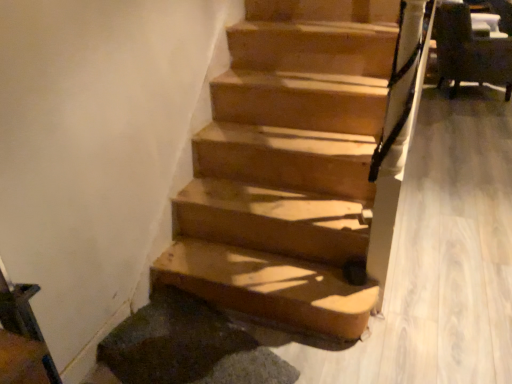
Question: Is dark brown leather armchair at upper right taller than wooden stairs at center?

Choices:
 (A) no
 (B) yes

Answer: (B)

Question: Is dark brown leather armchair at upper right closer to camera compared to wooden stairs at center?

Choices:
 (A) no
 (B) yes

Answer: (A)

Question: Is dark brown leather armchair at upper right looking in the opposite direction of wooden stairs at center?

Choices:
 (A) yes
 (B) no

Answer: (B)

Question: Is dark brown leather armchair at upper right at the right side of wooden stairs at center?

Choices:
 (A) no
 (B) yes

Answer: (B)

Question: Does dark brown leather armchair at upper right have a greater width compared to wooden stairs at center?

Choices:
 (A) yes
 (B) no

Answer: (B)

Question: Is dark brown leather armchair at upper right smaller than wooden stairs at center?

Choices:
 (A) no
 (B) yes

Answer: (B)

Question: From the image's perspective, is wooden stairs at center beneath dark brown leather armchair at upper right?

Choices:
 (A) yes
 (B) no

Answer: (A)

Question: Considering the relative sizes of wooden stairs at center and dark brown leather armchair at upper right in the image provided, is wooden stairs at center bigger than dark brown leather armchair at upper right?

Choices:
 (A) yes
 (B) no

Answer: (A)

Question: Does wooden stairs at center appear on the left side of dark brown leather armchair at upper right?

Choices:
 (A) yes
 (B) no

Answer: (A)

Question: Is dark brown leather armchair at upper right at the back of wooden stairs at center?

Choices:
 (A) no
 (B) yes

Answer: (A)

Question: From a real-world perspective, is wooden stairs at center on top of dark brown leather armchair at upper right?

Choices:
 (A) no
 (B) yes

Answer: (A)

Question: Considering the relative sizes of wooden stairs at center and dark brown leather armchair at upper right in the image provided, is wooden stairs at center smaller than dark brown leather armchair at upper right?

Choices:
 (A) no
 (B) yes

Answer: (A)

Question: Is dark brown leather armchair at upper right bigger or smaller than wooden stairs at center?

Choices:
 (A) small
 (B) big

Answer: (A)